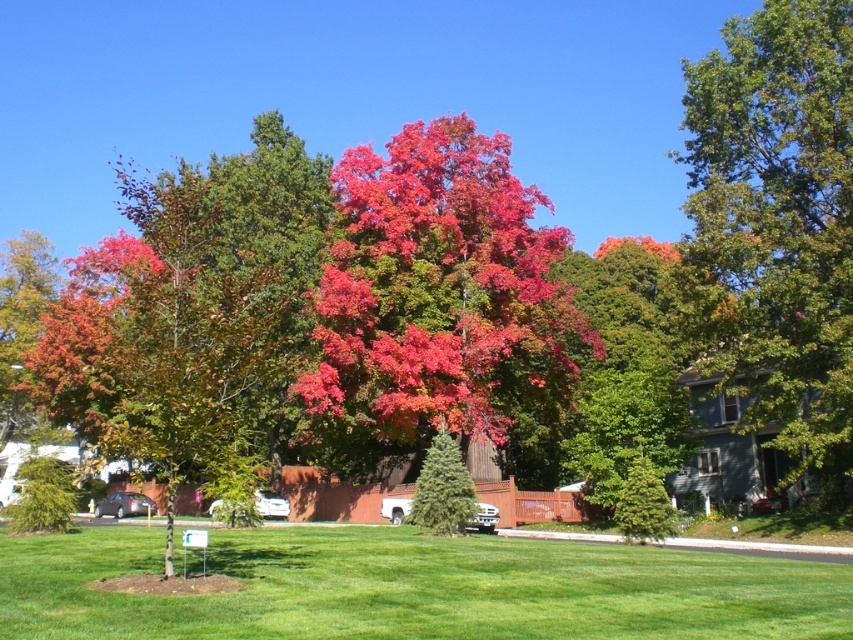
Question: Is the position of green grass at center less distant than that of green glossy tree at upper right?

Choices:
 (A) no
 (B) yes

Answer: (B)

Question: Among these points, which one is nearest to the camera?

Choices:
 (A) (460, 611)
 (B) (457, 422)
 (C) (450, 488)

Answer: (A)

Question: Is green grass at center bigger than green glossy tree at upper right?

Choices:
 (A) yes
 (B) no

Answer: (B)

Question: Which object is closer to the camera taking this photo?

Choices:
 (A) green grass at center
 (B) bright red maple at center
 (C) green textured evergreen tree at center
 (D) green glossy tree at upper right

Answer: (A)

Question: Which of the following is the closest to the observer?

Choices:
 (A) green textured evergreen tree at center
 (B) green grass at center
 (C) green glossy tree at upper right

Answer: (B)

Question: Can you confirm if bright red maple at center is positioned above green glossy tree at upper right?

Choices:
 (A) no
 (B) yes

Answer: (A)